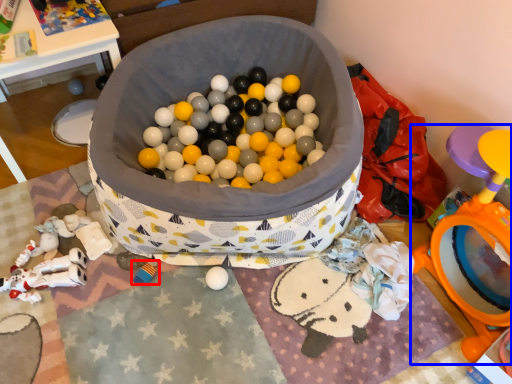
Question: Which object appears farthest to the camera in this image, toy (highlighted by a red box) or toy (highlighted by a blue box)?

Choices:
 (A) toy
 (B) toy

Answer: (A)